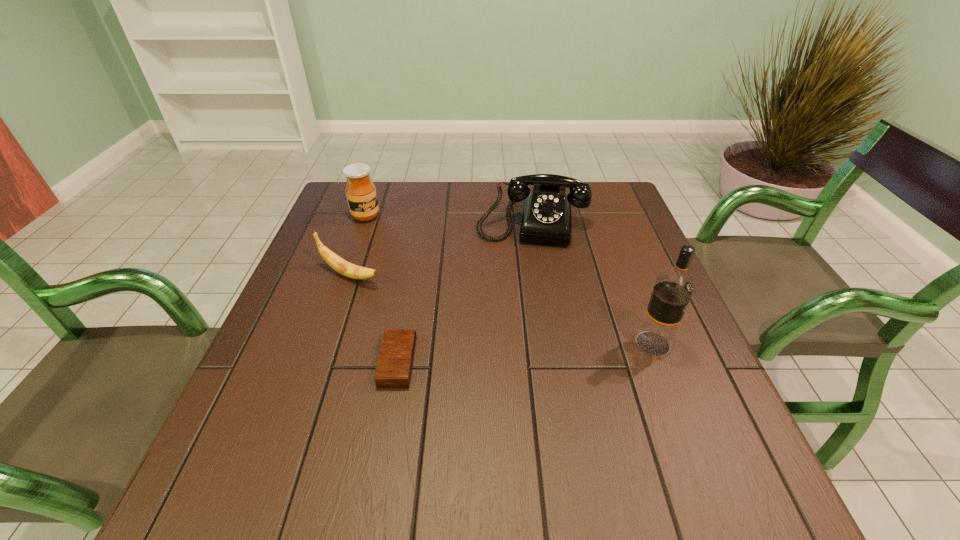
Locate an element on the screen. honey that is at the left edge is located at coordinates (361, 194).

Identify the location of banana that is at the left edge. (350, 270).

Identify the location of vodka that is at the right edge. The image size is (960, 540). (672, 291).

Locate an element on the screen. This screenshot has width=960, height=540. telephone that is at the right edge is located at coordinates pos(546,217).

The width and height of the screenshot is (960, 540). What are the coordinates of `object that is at the far left corner` in the screenshot? It's located at (361, 194).

Find the location of a particular element. This screenshot has width=960, height=540. object present at the far right corner is located at coordinates (546, 217).

Locate an element on the screen. The image size is (960, 540). vacant space at the far edge of the desktop is located at coordinates (399, 214).

In the image, there is a desktop. Find the location of `free space at the near edge`. free space at the near edge is located at coordinates (411, 428).

Where is `free space at the left edge of the desktop`? free space at the left edge of the desktop is located at coordinates (300, 354).

Where is `vacant position at the right edge of the desktop`? Image resolution: width=960 pixels, height=540 pixels. vacant position at the right edge of the desktop is located at coordinates (627, 356).